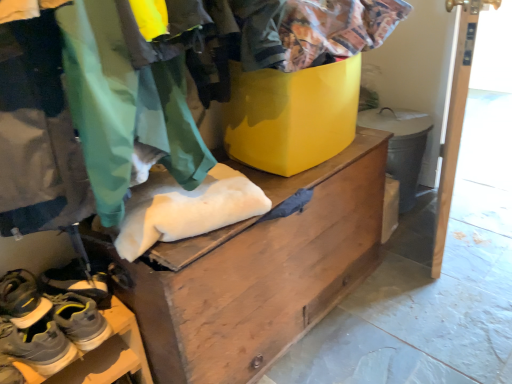
What do you see at coordinates (455, 117) in the screenshot?
I see `white wood door at right` at bounding box center [455, 117].

Image resolution: width=512 pixels, height=384 pixels. What do you see at coordinates (103, 355) in the screenshot?
I see `gray rubber shoes at lower left` at bounding box center [103, 355].

Image resolution: width=512 pixels, height=384 pixels. Describe the element at coordinates (80, 281) in the screenshot. I see `gray suede sneakers at lower left, the 1th footwear viewed from the top` at that location.

The height and width of the screenshot is (384, 512). Describe the element at coordinates (124, 106) in the screenshot. I see `camouflage fabric pants at lower left` at that location.

The image size is (512, 384). What do you see at coordinates (258, 271) in the screenshot?
I see `wooden chest at center` at bounding box center [258, 271].

Where is `white wood door at right`? white wood door at right is located at coordinates (455, 117).

Is camouflage fabric pants at lower left positioned beyond the bounds of gray suede sneakers at lower left, the 1th footwear viewed from the top?

That's correct, camouflage fabric pants at lower left is outside of gray suede sneakers at lower left, the 1th footwear viewed from the top.

Is camouflage fabric pants at lower left beside gray suede sneakers at lower left, the 1th footwear viewed from the top?

camouflage fabric pants at lower left and gray suede sneakers at lower left, the 1th footwear viewed from the top, are not in contact.

How far apart are camouflage fabric pants at lower left and gray suede sneakers at lower left, the 1th footwear viewed from the top?

They are 18.30 inches apart.

Visually, is camouflage fabric pants at lower left positioned to the left or to the right of gray suede sneakers at lower left, the 3th footwear positioned from the bottom?

From the image, it's evident that camouflage fabric pants at lower left is to the right of gray suede sneakers at lower left, the 3th footwear positioned from the bottom.

From a real-world perspective, who is located lower, camouflage fabric pants at lower left or gray suede sneakers at lower left, the 2th footwear when ordered from top to bottom?

From a 3D spatial view, gray suede sneakers at lower left, the 2th footwear when ordered from top to bottom, is below.

Looking at their sizes, would you say camouflage fabric pants at lower left is wider or thinner than gray suede sneakers at lower left, the 2th footwear when ordered from top to bottom?

Clearly, camouflage fabric pants at lower left has more width compared to gray suede sneakers at lower left, the 2th footwear when ordered from top to bottom.

Is the depth of camouflage fabric pants at lower left greater than that of gray suede sneakers at lower left, the 2th footwear when ordered from top to bottom?

No, camouflage fabric pants at lower left is closer to the camera.

Considering the sizes of camouflage fabric pants at lower left and gray suede sneakers at lower left, the 2th footwear when ordered from top to bottom, in the image, is camouflage fabric pants at lower left bigger or smaller than gray suede sneakers at lower left, the 2th footwear when ordered from top to bottom,?

In the image, camouflage fabric pants at lower left appears to be larger than gray suede sneakers at lower left, the 2th footwear when ordered from top to bottom.

Are gray rubber shoes at lower left and gray suede sneakers at lower left, the 3th footwear positioned from the bottom, beside each other?

gray rubber shoes at lower left and gray suede sneakers at lower left, the 3th footwear positioned from the bottom, are not in contact.

Is gray rubber shoes at lower left wider or thinner than gray suede sneakers at lower left, the 1th footwear viewed from the top?

Considering their sizes, gray rubber shoes at lower left looks broader than gray suede sneakers at lower left, the 1th footwear viewed from the top.

From the image's perspective, does gray rubber shoes at lower left appear higher than gray suede sneakers at lower left, the 3th footwear positioned from the bottom?

No, from the image's perspective, gray rubber shoes at lower left is not on top of gray suede sneakers at lower left, the 3th footwear positioned from the bottom.

Can you confirm if gray suede sneakers at lower left, positioned as the second footwear in bottom-to-top order, is positioned to the left of white wood door at right?

Yes.

Considering the sizes of gray suede sneakers at lower left, the 2th footwear when ordered from top to bottom, and white wood door at right in the image, is gray suede sneakers at lower left, the 2th footwear when ordered from top to bottom, bigger or smaller than white wood door at right?

In the image, gray suede sneakers at lower left, the 2th footwear when ordered from top to bottom, appears to be smaller than white wood door at right.

Can you confirm if gray suede sneakers at lower left, positioned as the second footwear in bottom-to-top order, is shorter than white wood door at right?

Yes.

Is gray suede sneakers at lower left, positioned as the second footwear in bottom-to-top order, wider or thinner than white wood door at right?

Clearly, gray suede sneakers at lower left, positioned as the second footwear in bottom-to-top order, has more width compared to white wood door at right.

From a real-world perspective, which object rests below the other?

gray suede sneakers at lower left, which is counted as the 3th footwear, starting from the top, is physically lower.

Can you confirm if gray suede sneakers at lower left, the 1th footwear viewed from the top, is smaller than gray suede sneakers at lower left, which is counted as the 3th footwear, starting from the top?

Correct, gray suede sneakers at lower left, the 1th footwear viewed from the top, occupies less space than gray suede sneakers at lower left, which is counted as the 3th footwear, starting from the top.

From the image's perspective, is gray suede sneakers at lower left, the 3th footwear positioned from the bottom, above or below gray suede sneakers at lower left, which is counted as the 3th footwear, starting from the top?

gray suede sneakers at lower left, the 3th footwear positioned from the bottom, is above gray suede sneakers at lower left, which is counted as the 3th footwear, starting from the top.

Choose the correct answer: Is gray suede sneakers at lower left, the 3th footwear positioned from the bottom, inside gray suede sneakers at lower left, which is counted as the 3th footwear, starting from the top, or outside it?

gray suede sneakers at lower left, the 3th footwear positioned from the bottom, is not enclosed by gray suede sneakers at lower left, which is counted as the 3th footwear, starting from the top.

Between gray suede sneakers at lower left, which is counted as the 3th footwear, starting from the top, and gray suede sneakers at lower left, the 2th footwear when ordered from top to bottom, which one is positioned behind?

gray suede sneakers at lower left, the 2th footwear when ordered from top to bottom, is further away from the camera.

Is gray suede sneakers at lower left, which is the 1th footwear in bottom-to-top order, spatially inside gray suede sneakers at lower left, positioned as the second footwear in bottom-to-top order, or outside of it?

gray suede sneakers at lower left, which is the 1th footwear in bottom-to-top order, lies outside gray suede sneakers at lower left, positioned as the second footwear in bottom-to-top order.

Is point (30, 338) more distant than point (29, 305)?

Yes, point (30, 338) is behind point (29, 305).

From the picture: Which of these two, gray suede sneakers at lower left, which is the 1th footwear in bottom-to-top order, or gray suede sneakers at lower left, positioned as the second footwear in bottom-to-top order, stands shorter?

gray suede sneakers at lower left, positioned as the second footwear in bottom-to-top order, is shorter.

Considering the sizes of objects gray rubber shoes at lower left and gray suede sneakers at lower left, the 2th footwear when ordered from top to bottom, in the image provided, who is shorter, gray rubber shoes at lower left or gray suede sneakers at lower left, the 2th footwear when ordered from top to bottom,?

gray suede sneakers at lower left, the 2th footwear when ordered from top to bottom.

Is gray rubber shoes at lower left at the right side of gray suede sneakers at lower left, positioned as the second footwear in bottom-to-top order?

Indeed, gray rubber shoes at lower left is positioned on the right side of gray suede sneakers at lower left, positioned as the second footwear in bottom-to-top order.

Is gray rubber shoes at lower left facing away from gray suede sneakers at lower left, positioned as the second footwear in bottom-to-top order?

gray rubber shoes at lower left does not have its back to gray suede sneakers at lower left, positioned as the second footwear in bottom-to-top order.

Find the location of a particular element. clothing in front of the gray suede sneakers at lower left, the 3th footwear positioned from the bottom is located at coordinates (124, 106).

Where is `clothing above the gray suede sneakers at lower left, positioned as the second footwear in bottom-to-top order (from the image's perspective)`? The image size is (512, 384). clothing above the gray suede sneakers at lower left, positioned as the second footwear in bottom-to-top order (from the image's perspective) is located at coordinates (124, 106).

Estimate the real-world distances between objects in this image. Which object is closer to gray suede sneakers at lower left, the 2th footwear when ordered from top to bottom, gray suede sneakers at lower left, the 3th footwear positioned from the bottom, or white wood door at right?

gray suede sneakers at lower left, the 3th footwear positioned from the bottom, lies closer to gray suede sneakers at lower left, the 2th footwear when ordered from top to bottom, than the other object.

Looking at the image, which one is located further to gray rubber shoes at lower left, camouflage fabric pants at lower left or gray suede sneakers at lower left, which is counted as the 3th footwear, starting from the top?

Based on the image, camouflage fabric pants at lower left appears to be further to gray rubber shoes at lower left.

Which object lies further to the anchor point gray suede sneakers at lower left, the 3th footwear positioned from the bottom, gray suede sneakers at lower left, which is the 1th footwear in bottom-to-top order, or camouflage fabric pants at lower left?

camouflage fabric pants at lower left is further to gray suede sneakers at lower left, the 3th footwear positioned from the bottom.

Estimate the real-world distances between objects in this image. Which object is further from camouflage fabric pants at lower left, wooden chest at center or gray suede sneakers at lower left, the 1th footwear viewed from the top?

gray suede sneakers at lower left, the 1th footwear viewed from the top, lies further to camouflage fabric pants at lower left than the other object.

In the scene shown: Which object lies further to the anchor point camouflage fabric pants at lower left, gray suede sneakers at lower left, the 1th footwear viewed from the top, or gray suede sneakers at lower left, which is counted as the 3th footwear, starting from the top?

Based on the image, gray suede sneakers at lower left, which is counted as the 3th footwear, starting from the top, appears to be further to camouflage fabric pants at lower left.

From the picture: When comparing their distances from gray suede sneakers at lower left, the 1th footwear viewed from the top, does gray suede sneakers at lower left, positioned as the second footwear in bottom-to-top order, or white wood door at right seem closer?

Based on the image, gray suede sneakers at lower left, positioned as the second footwear in bottom-to-top order, appears to be nearer to gray suede sneakers at lower left, the 1th footwear viewed from the top.

When comparing their distances from camouflage fabric pants at lower left, does white wood door at right or wooden chest at center seem further?

The object further to camouflage fabric pants at lower left is white wood door at right.

Which object lies nearer to the anchor point gray suede sneakers at lower left, positioned as the second footwear in bottom-to-top order, wooden chest at center or gray suede sneakers at lower left, which is the 1th footwear in bottom-to-top order?

gray suede sneakers at lower left, which is the 1th footwear in bottom-to-top order, lies closer to gray suede sneakers at lower left, positioned as the second footwear in bottom-to-top order, than the other object.

At what (x,y) coordinates should I click in order to perform the action: click on furniture between gray suede sneakers at lower left, which is counted as the 3th footwear, starting from the top, and wooden chest at center. Please return your answer as a coordinate pair (x, y). The width and height of the screenshot is (512, 384). Looking at the image, I should click on (103, 355).

Image resolution: width=512 pixels, height=384 pixels. Find the location of `furniture situated between gray suede sneakers at lower left, the 2th footwear when ordered from top to bottom, and wooden chest at center from left to right`. furniture situated between gray suede sneakers at lower left, the 2th footwear when ordered from top to bottom, and wooden chest at center from left to right is located at coordinates (103, 355).

Locate an element on the screen. Image resolution: width=512 pixels, height=384 pixels. chest of drawers between gray suede sneakers at lower left, which is the 1th footwear in bottom-to-top order, and white wood door at right is located at coordinates (258, 271).

Find the location of a particular element. This screenshot has width=512, height=384. clothing between gray suede sneakers at lower left, the 3th footwear positioned from the bottom, and white wood door at right is located at coordinates (124, 106).